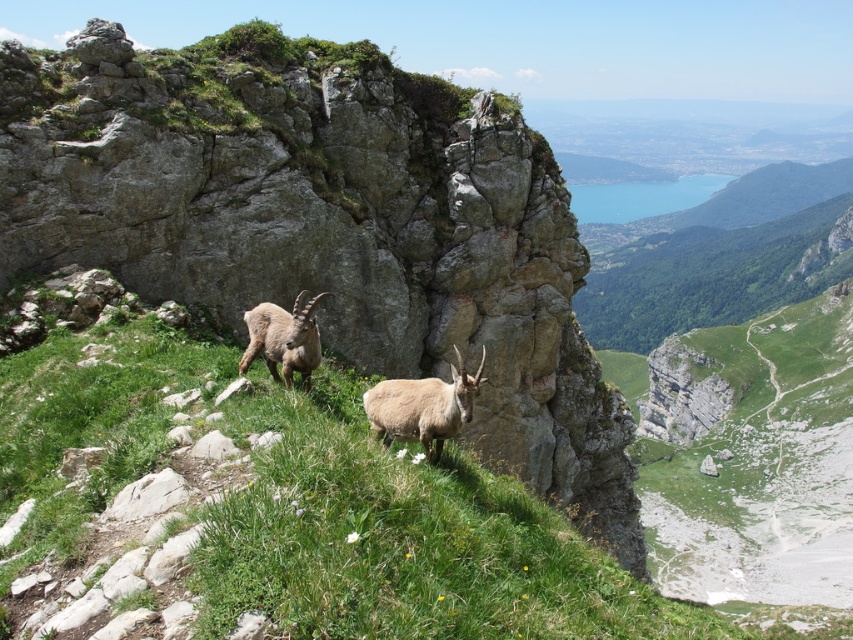
Based on the photo, can you confirm if light brown woolen ram at center is positioned below light brown woolen goat at center?

Yes, light brown woolen ram at center is below light brown woolen goat at center.

The image size is (853, 640). What do you see at coordinates (422, 406) in the screenshot?
I see `light brown woolen ram at center` at bounding box center [422, 406].

Between point (465, 385) and point (251, 326), which one is positioned behind?

Positioned behind is point (251, 326).

Where is `light brown woolen ram at center`? This screenshot has width=853, height=640. light brown woolen ram at center is located at coordinates (422, 406).